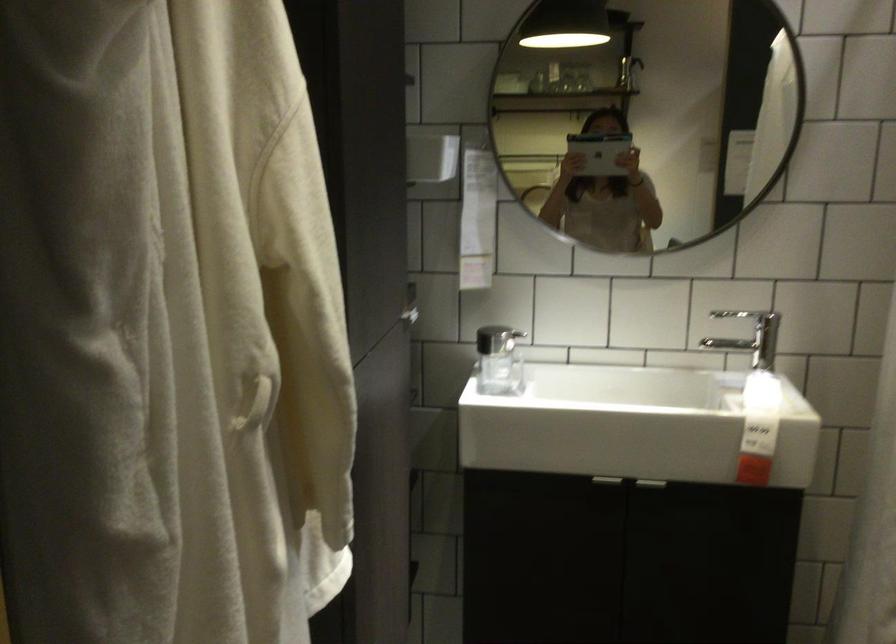
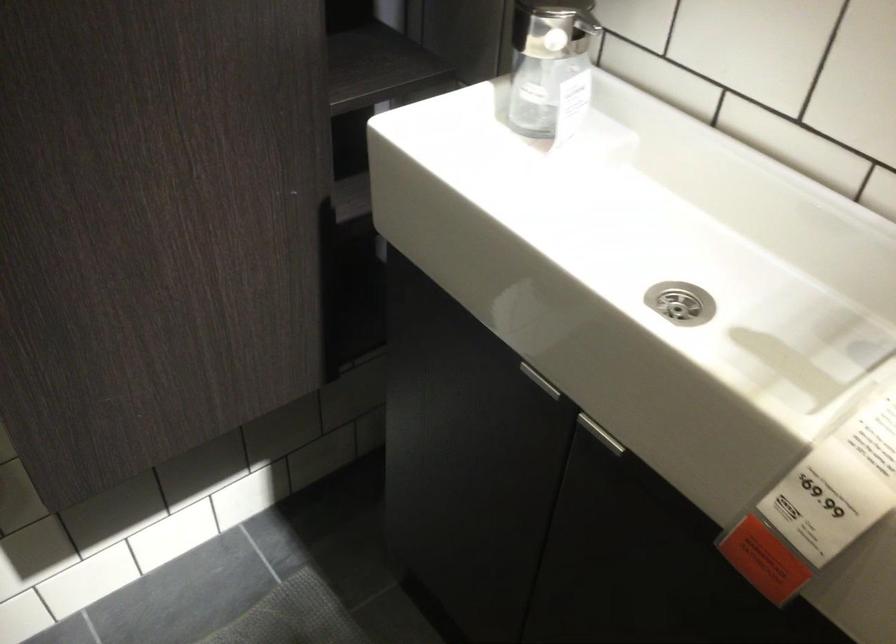
Locate, in the second image, the point that corresponds to the point at 771,431 in the first image.

(826, 502)